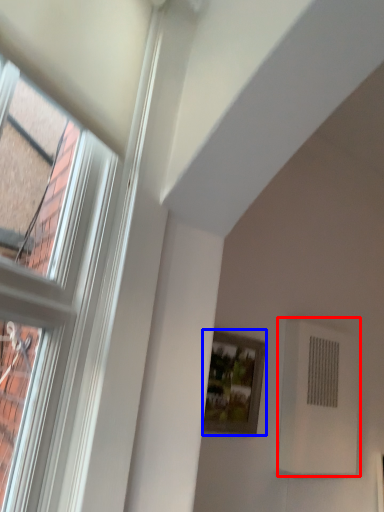
Question: Which point is further to the camera, air conditioning (highlighted by a red box) or picture frame (highlighted by a blue box)?

Choices:
 (A) air conditioning
 (B) picture frame

Answer: (A)